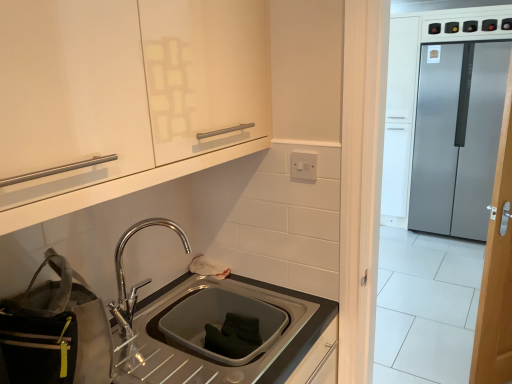
Locate an element on the screen. gray fabric bag at lower left is located at coordinates (56, 331).

I want to click on matte white cabinet at upper left, so click(124, 97).

What do you see at coordinates (497, 276) in the screenshot?
I see `wooden door at right` at bounding box center [497, 276].

This screenshot has height=384, width=512. In order to click on satin steel sink at lower center in this screenshot , I will do `click(253, 359)`.

Does point (188, 73) come farther from viewer compared to point (312, 363)?

No, (188, 73) is closer to viewer.

Considering the sizes of objects matte white cabinet at upper left and satin steel sink at lower center in the image provided, who is thinner, matte white cabinet at upper left or satin steel sink at lower center?

matte white cabinet at upper left is thinner.

Is matte white cabinet at upper left not near satin steel sink at lower center?

No.

Is matte white cabinet at upper left bigger or smaller than satin steel sink at lower center?

Clearly, matte white cabinet at upper left is larger in size than satin steel sink at lower center.

Is gray fabric bag at lower left inside or outside of matte white cabinet at upper left?

gray fabric bag at lower left exists outside the volume of matte white cabinet at upper left.

From the image's perspective, is gray fabric bag at lower left over matte white cabinet at upper left?

No, from the image's perspective, gray fabric bag at lower left is not above matte white cabinet at upper left.

Considering the sizes of gray fabric bag at lower left and matte white cabinet at upper left in the image, is gray fabric bag at lower left taller or shorter than matte white cabinet at upper left?

In the image, gray fabric bag at lower left appears to be shorter than matte white cabinet at upper left.

Could you tell me if satin silver refrigerator at right is turned towards white plastic electric outlet at upper center?

Yes, satin silver refrigerator at right is oriented towards white plastic electric outlet at upper center.

Are satin silver refrigerator at right and white plastic electric outlet at upper center making contact?

There is a gap between satin silver refrigerator at right and white plastic electric outlet at upper center.

Based on their positions, is satin silver refrigerator at right located to the left or right of white plastic electric outlet at upper center?

In the image, satin silver refrigerator at right appears on the right side of white plastic electric outlet at upper center.

Is satin silver refrigerator at right further to the viewer compared to white plastic electric outlet at upper center?

Yes, the depth of satin silver refrigerator at right is greater than that of white plastic electric outlet at upper center.

Is white plastic electric outlet at upper center thinner than satin silver refrigerator at right?

Indeed, white plastic electric outlet at upper center has a lesser width compared to satin silver refrigerator at right.

Is white plastic electric outlet at upper center facing towards satin silver refrigerator at right?

No, white plastic electric outlet at upper center is not facing towards satin silver refrigerator at right.

Which is more to the right, white plastic electric outlet at upper center or satin silver refrigerator at right?

satin silver refrigerator at right.

From a real-world perspective, is white plastic electric outlet at upper center physically located above or below satin silver refrigerator at right?

From a real-world perspective, white plastic electric outlet at upper center is physically above satin silver refrigerator at right.

Considering the relative sizes of satin silver refrigerator at right and wooden door at right in the image provided, is satin silver refrigerator at right wider than wooden door at right?

Correct, the width of satin silver refrigerator at right exceeds that of wooden door at right.

Which is nearer, (449, 198) or (511, 160)?

Point (449, 198).

From a real-world perspective, is satin silver refrigerator at right positioned under wooden door at right based on gravity?

No, from a real-world perspective, satin silver refrigerator at right is not under wooden door at right.

Is satin silver refrigerator at right further to the viewer compared to wooden door at right?

Yes, satin silver refrigerator at right is behind wooden door at right.

Which is more to the right, polished chrome tap at lower center or matte white cabinet at upper left?

polished chrome tap at lower center is more to the right.

Considering the sizes of objects polished chrome tap at lower center and matte white cabinet at upper left in the image provided, who is shorter, polished chrome tap at lower center or matte white cabinet at upper left?

Standing shorter between the two is polished chrome tap at lower center.

Which object is thinner, polished chrome tap at lower center or matte white cabinet at upper left?

polished chrome tap at lower center.

From a real-world perspective, does polished chrome tap at lower center stand above matte white cabinet at upper left?

No.

From the image's perspective, relative to white plastic electric outlet at upper center, is wooden door at right above or below?

wooden door at right is below white plastic electric outlet at upper center.

Is wooden door at right situated inside white plastic electric outlet at upper center or outside?

The correct answer is: outside.

Which is less distant, [499,308] or [292,152]?

Point [499,308] appears to be farther away from the viewer than point [292,152].

The image size is (512, 384). Find the location of `countertop below the matte white cabinet at upper left (from a real-world perspective)`. countertop below the matte white cabinet at upper left (from a real-world perspective) is located at coordinates (253, 359).

Find the location of `bag that appears behind the matte white cabinet at upper left`. bag that appears behind the matte white cabinet at upper left is located at coordinates (56, 331).

Looking at the image, which one is located further to satin steel sink at lower center, wooden door at right or matte white cabinet at upper left?

Based on the image, wooden door at right appears to be further to satin steel sink at lower center.

Estimate the real-world distances between objects in this image. Which object is closer to matte white cabinet at upper left, wooden door at right or satin steel sink at lower center?

The object closer to matte white cabinet at upper left is satin steel sink at lower center.

Based on the photo, considering their positions, is wooden door at right positioned further to matte white cabinet at upper left than satin silver refrigerator at right?

The object further to matte white cabinet at upper left is satin silver refrigerator at right.

Based on their spatial positions, is white plastic electric outlet at upper center or satin silver refrigerator at right closer to wooden door at right?

The object closer to wooden door at right is white plastic electric outlet at upper center.

When comparing their distances from matte white cabinet at upper left, does satin silver refrigerator at right or polished chrome tap at lower center seem closer?

The object closer to matte white cabinet at upper left is polished chrome tap at lower center.

Based on their spatial positions, is satin steel sink at lower center or white plastic electric outlet at upper center closer to gray fabric bag at lower left?

The object closer to gray fabric bag at lower left is satin steel sink at lower center.

From the image, which object appears to be nearer to matte white cabinet at upper left, wooden door at right or gray fabric bag at lower left?

gray fabric bag at lower left lies closer to matte white cabinet at upper left than the other object.

Considering their positions, is satin silver refrigerator at right positioned closer to gray fabric bag at lower left than white plastic electric outlet at upper center?

Based on the image, white plastic electric outlet at upper center appears to be nearer to gray fabric bag at lower left.

This screenshot has height=384, width=512. What are the coordinates of `tap between gray fabric bag at lower left and white plastic electric outlet at upper center` in the screenshot? It's located at (123, 272).

Where is `tap between gray fabric bag at lower left and satin silver refrigerator at right in the front-back direction`? The image size is (512, 384). tap between gray fabric bag at lower left and satin silver refrigerator at right in the front-back direction is located at coordinates (123, 272).

Identify the location of electric outlet located between gray fabric bag at lower left and satin silver refrigerator at right in the depth direction. (304, 166).

Locate an element on the screen. bag between matte white cabinet at upper left and satin steel sink at lower center vertically is located at coordinates (56, 331).